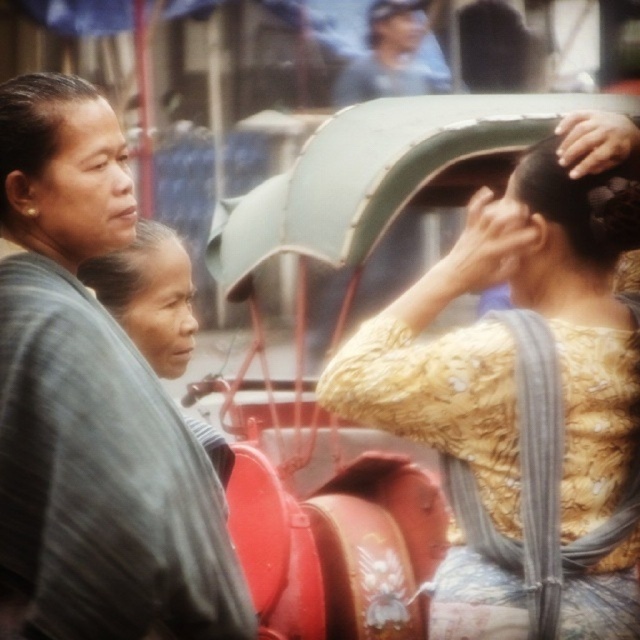
You are a photographer trying to capture a candid shot of the golden textured hair at upper right without including the matte gray jacket at left in the frame. Based on their positions, is this possible?

The matte gray jacket at left is positioned on the left side of golden textured hair at upper right, so it is possible to frame the shot to exclude the matte gray jacket at left while capturing the golden textured hair at upper right.

Consider the image. You are a photographer trying to capture a shot of the matte gray jacket at left and the matte blue shirt at upper center. Which object should you focus on first if you want to start with the one closer to the camera?

The matte gray jacket at left is positioned on the left side of the matte blue shirt at upper center, so it is closer to the camera. Therefore, you should focus on the matte gray jacket at left first.

You are a photographer trying to capture a candid shot of the two women in the scene. You notice two specific points marked as point 1 at coordinate (40,531) and point 2 at coordinate (419,36). Which point should you focus on to ensure the subject in front is sharp and in focus?

Point 1 at coordinate (40,531) should be focused on because it is in front of point 2 at coordinate (419,36), making it closer to the camera and thus the subject in focus.